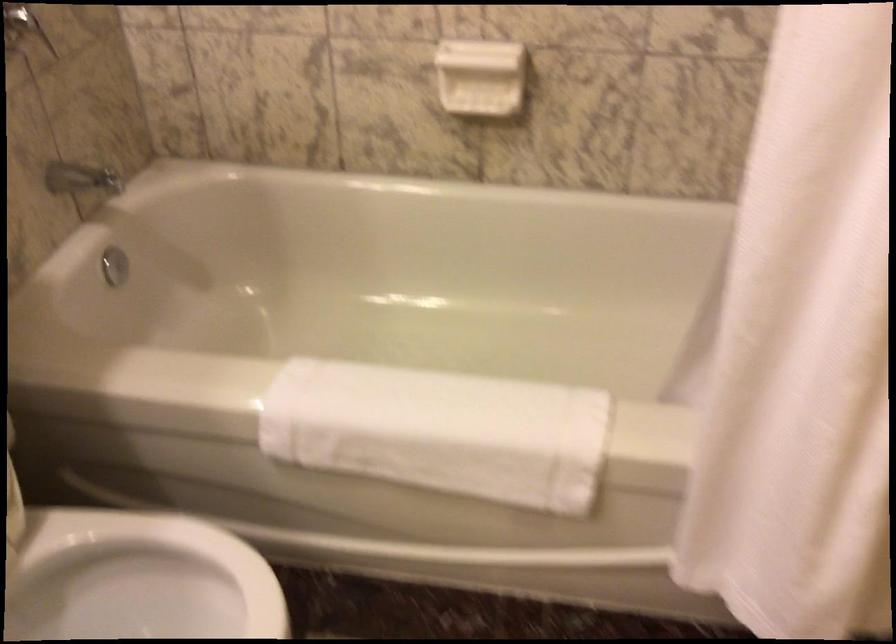
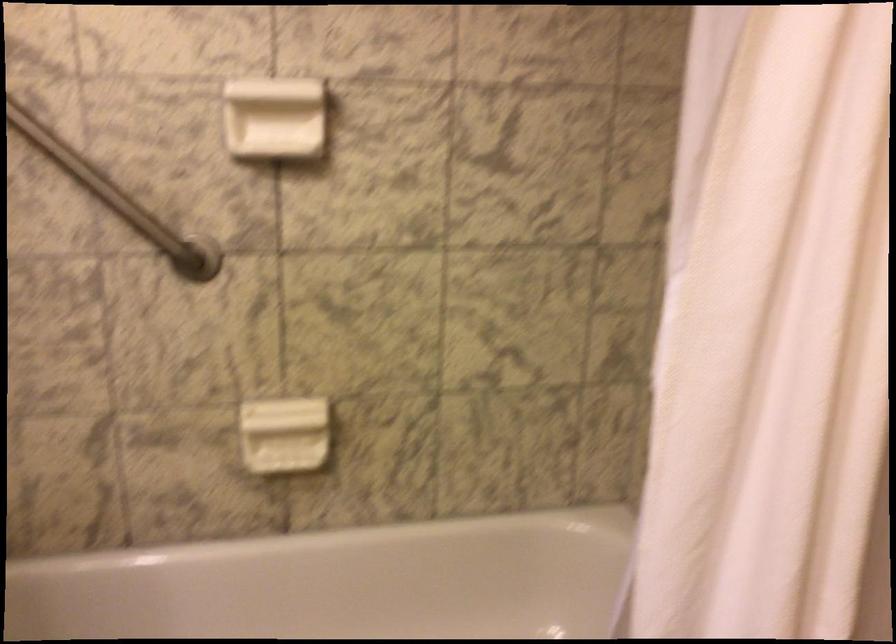
Question: Which direction would the cameraman need to move to produce the second image? Reply with the corresponding letter.

Choices:
 (A) Left
 (B) Right
 (C) Forward
 (D) Backward

Answer: (A)